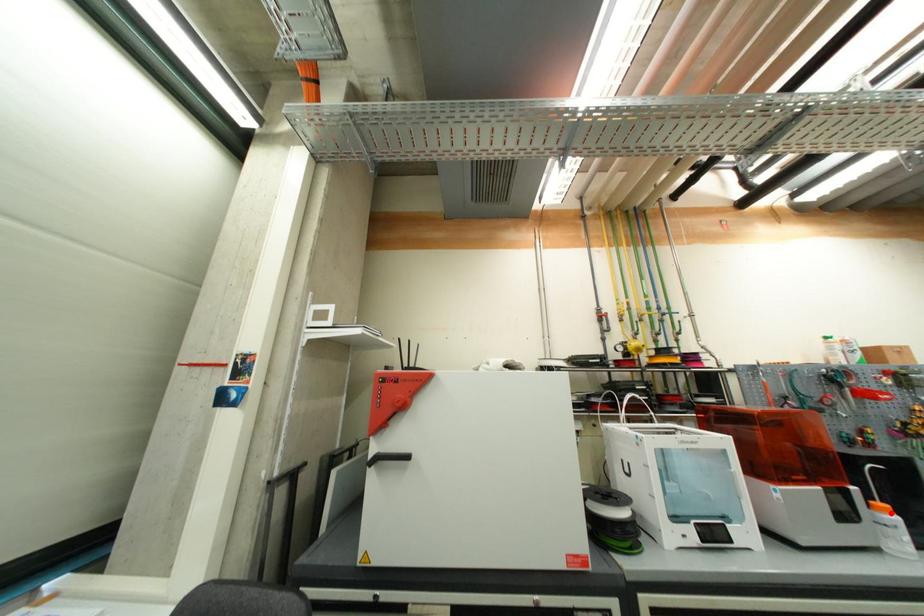
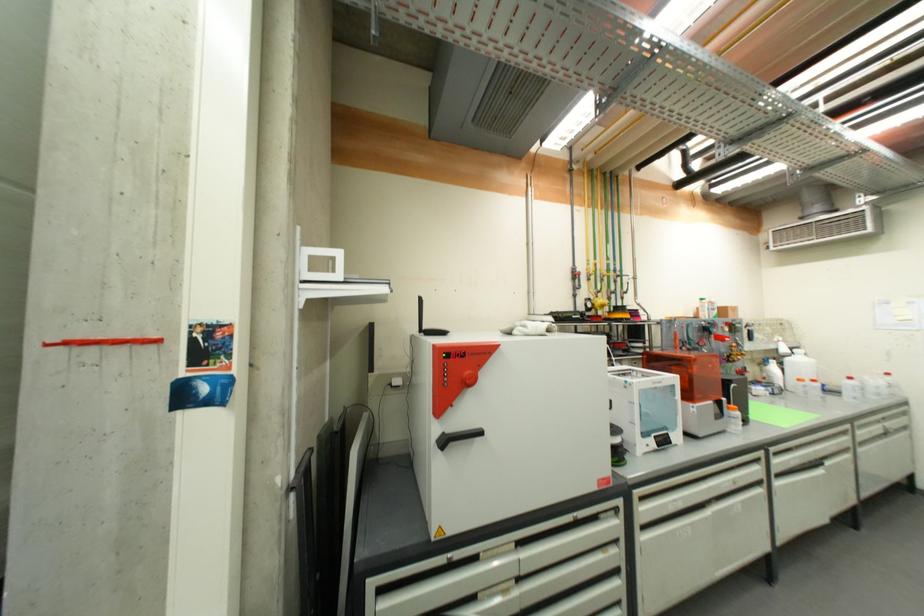
The point at the highlighted location is marked in the first image. Where is the corresponding point in the second image?

(739, 411)